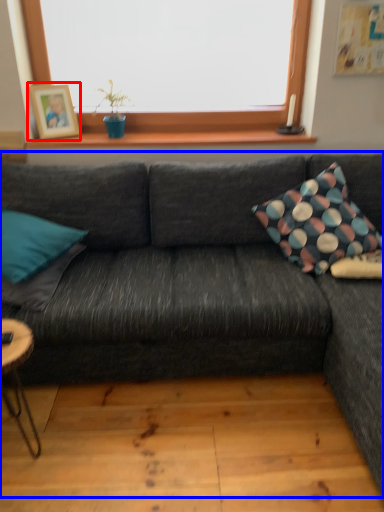
Question: Which object is further to the camera taking this photo, picture frame (highlighted by a red box) or studio couch (highlighted by a blue box)?

Choices:
 (A) picture frame
 (B) studio couch

Answer: (A)